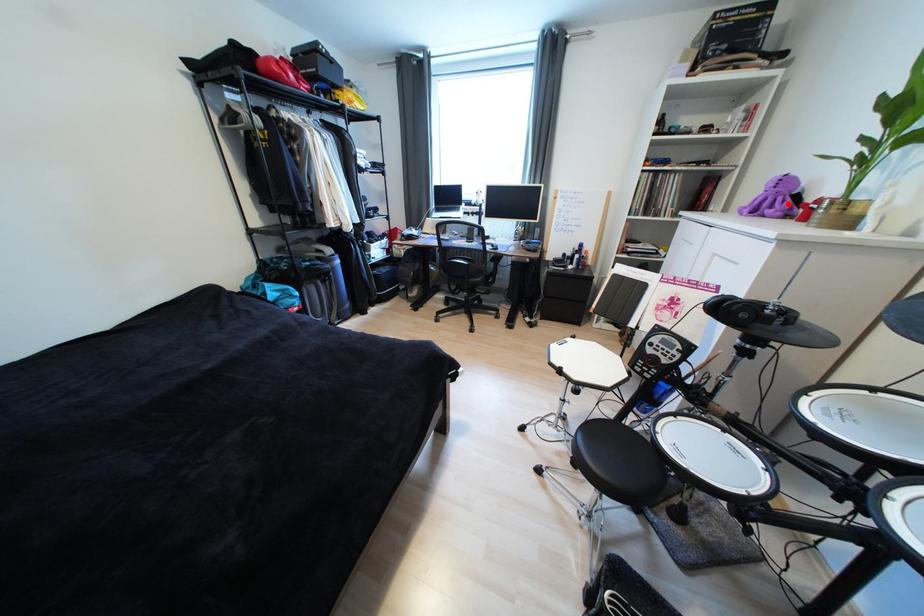
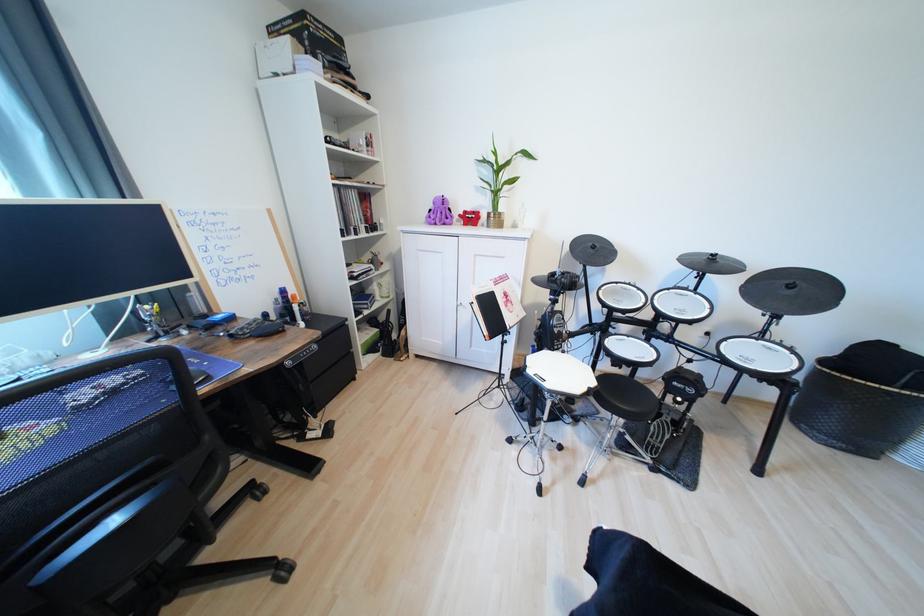
Where in the second image is the point corresponding to the highlighted location from the first image?

(447, 216)